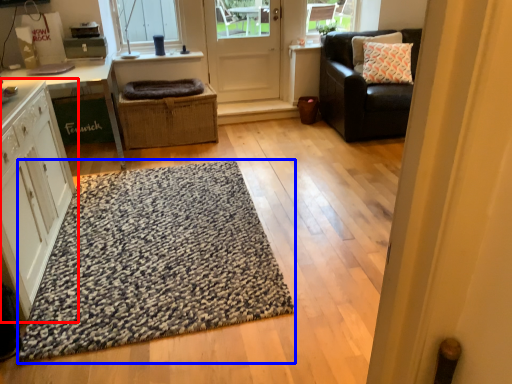
Question: Among these objects, which one is nearest to the camera, cabinetry (highlighted by a red box) or doormat (highlighted by a blue box)?

Choices:
 (A) cabinetry
 (B) doormat

Answer: (A)